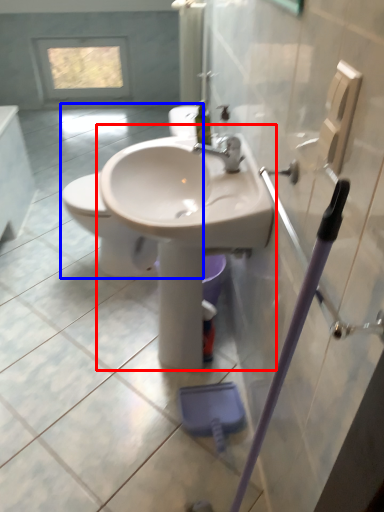
Question: Which of the following is the closest to the observer, sink (highlighted by a red box) or toilet (highlighted by a blue box)?

Choices:
 (A) sink
 (B) toilet

Answer: (A)